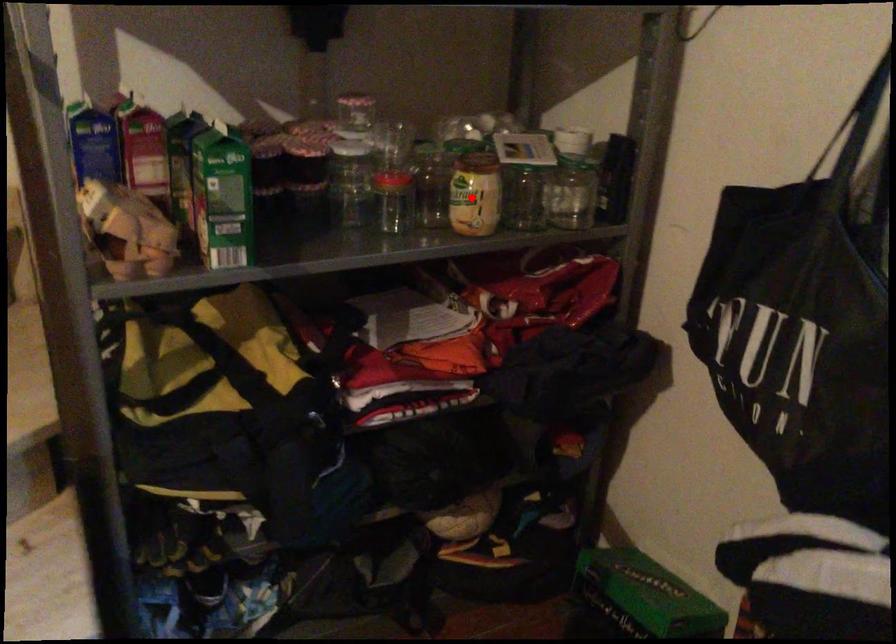
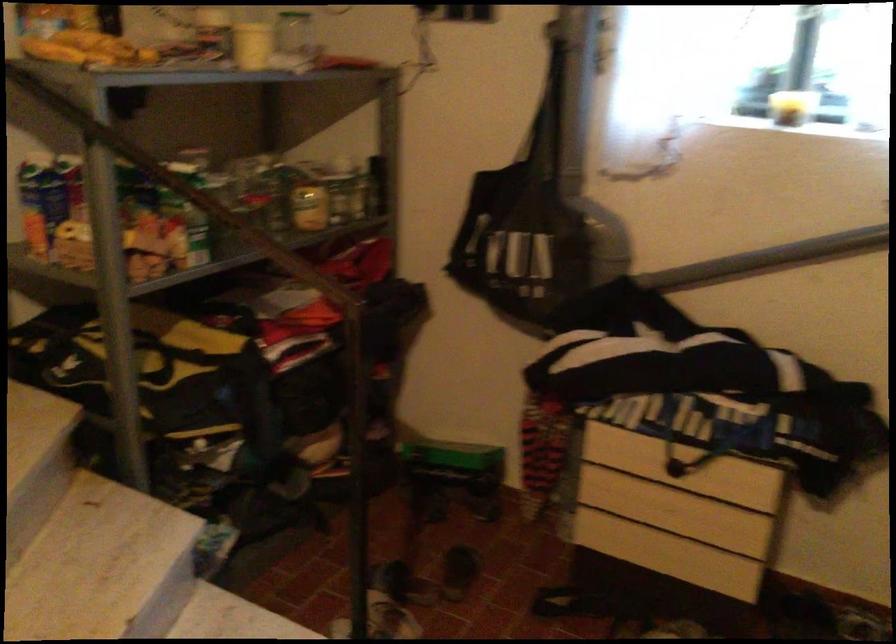
The point at the highlighted location is marked in the first image. Where is the corresponding point in the second image?

(309, 205)